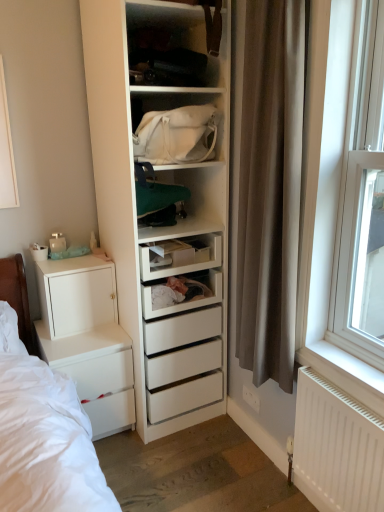
Question: Could you tell me if white matte chest of drawers at left is facing white plastic window at right?

Choices:
 (A) yes
 (B) no

Answer: (B)

Question: Does white matte chest of drawers at left have a greater height compared to white plastic window at right?

Choices:
 (A) yes
 (B) no

Answer: (B)

Question: Is white matte chest of drawers at left looking in the opposite direction of white plastic window at right?

Choices:
 (A) yes
 (B) no

Answer: (B)

Question: Is white matte chest of drawers at left at the left side of white plastic window at right?

Choices:
 (A) yes
 (B) no

Answer: (A)

Question: Considering the relative sizes of white matte chest of drawers at left and white plastic window at right in the image provided, is white matte chest of drawers at left wider than white plastic window at right?

Choices:
 (A) yes
 (B) no

Answer: (A)

Question: Is white plastic window at right inside white matte chest of drawers at left?

Choices:
 (A) no
 (B) yes

Answer: (A)

Question: From the image's perspective, is white matte chest of drawers at left beneath brown fabric curtain at right?

Choices:
 (A) no
 (B) yes

Answer: (B)

Question: Does white matte chest of drawers at left have a lesser width compared to brown fabric curtain at right?

Choices:
 (A) no
 (B) yes

Answer: (A)

Question: Is white matte chest of drawers at left in front of brown fabric curtain at right?

Choices:
 (A) no
 (B) yes

Answer: (A)

Question: Does white matte chest of drawers at left have a greater height compared to brown fabric curtain at right?

Choices:
 (A) yes
 (B) no

Answer: (B)

Question: Is white matte chest of drawers at left located outside brown fabric curtain at right?

Choices:
 (A) yes
 (B) no

Answer: (A)

Question: Is white matte chest of drawers at left further to camera compared to brown fabric curtain at right?

Choices:
 (A) no
 (B) yes

Answer: (B)

Question: Is the depth of brown fabric curtain at right greater than that of white plastic window at right?

Choices:
 (A) no
 (B) yes

Answer: (B)